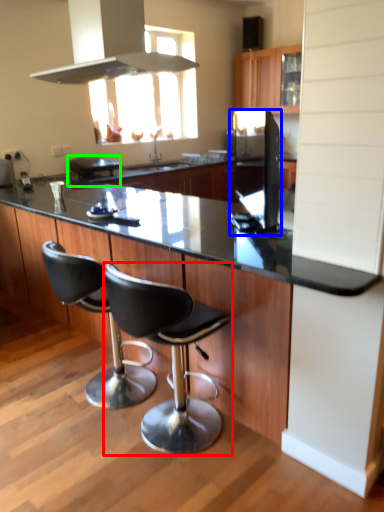
Question: Considering the real-world distances, which object is closest to chair (highlighted by a red box)? appliance (highlighted by a blue box) or appliance (highlighted by a green box).

Choices:
 (A) appliance
 (B) appliance

Answer: (A)